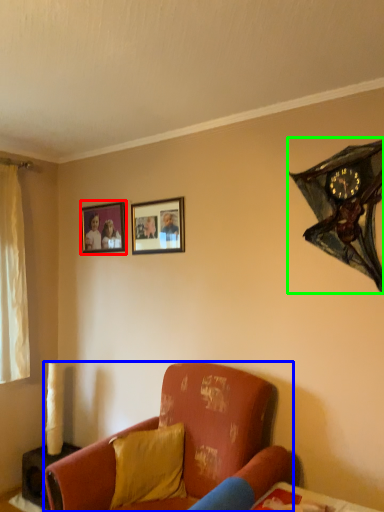
Question: Based on their relative distances, which object is farther from picture frame (highlighted by a red box)? Choose from studio couch (highlighted by a blue box) and clock (highlighted by a green box).

Choices:
 (A) studio couch
 (B) clock

Answer: (B)